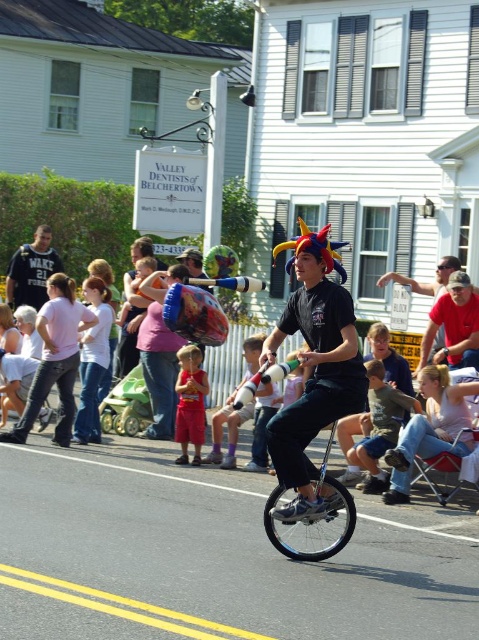
Looking at this image, can you confirm if pink fabric balloon at center is taller than red cotton shorts at center?

Yes, pink fabric balloon at center is taller than red cotton shorts at center.

Is point (140, 336) closer to viewer compared to point (200, 458)?

No.

Find the location of a particular element. pink fabric balloon at center is located at coordinates (159, 355).

Is point (441, 316) positioned before point (94, 428)?

Yes, it is.

Can you confirm if matte black shirt at center is positioned to the right of jeans at left?

Indeed, matte black shirt at center is positioned on the right side of jeans at left.

This screenshot has width=479, height=640. Describe the element at coordinates (454, 324) in the screenshot. I see `matte black shirt at center` at that location.

You are a GUI agent. You are given a task and a screenshot of the screen. Output one action in this format:
    pyautogui.click(x=<x>, y=<y>)
    Task: Click on the matte black shirt at center
    This screenshot has width=479, height=640.
    Given the screenshot: What is the action you would take?
    pyautogui.click(x=454, y=324)

What do you see at coordinates (379, 426) in the screenshot? I see `denim shorts at lower right` at bounding box center [379, 426].

Between denim shorts at lower right and red cotton shorts at center, which one appears on the left side from the viewer's perspective?

Positioned to the left is red cotton shorts at center.

Measure the distance between denim shorts at lower right and camera.

denim shorts at lower right and camera are 8.86 meters apart.

Identify the location of denim shorts at lower right. The width and height of the screenshot is (479, 640). pyautogui.click(x=379, y=426).